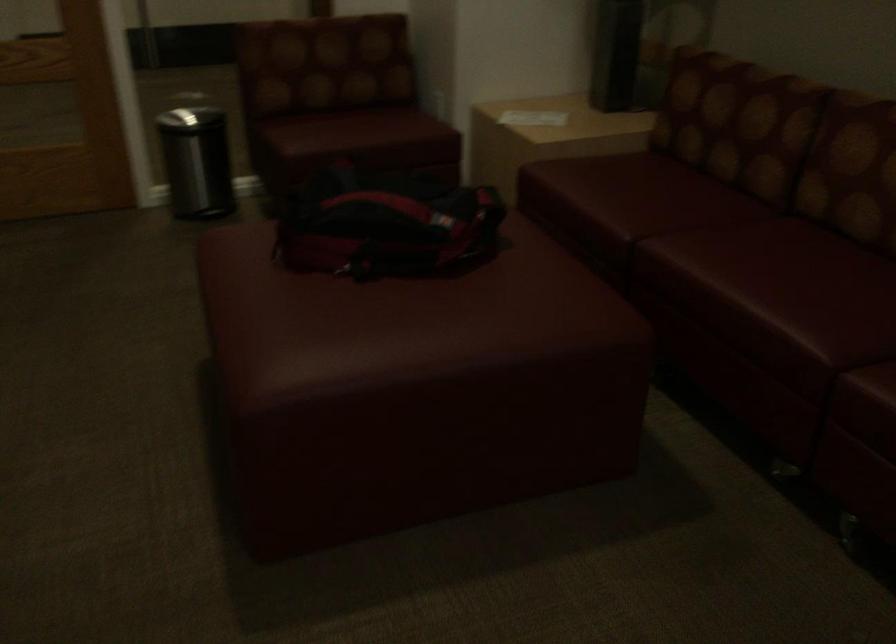
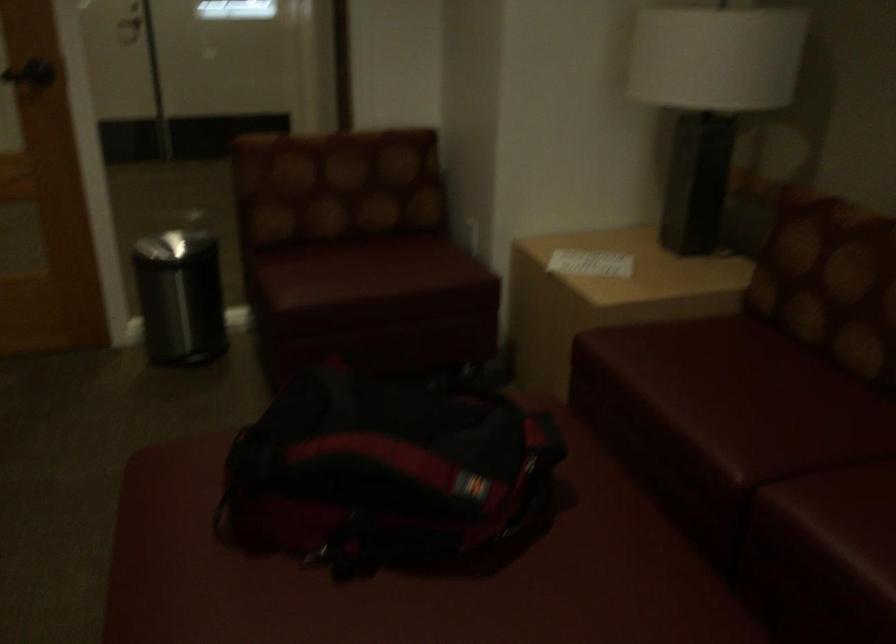
Find the pixel in the second image that matches point 688,252 in the first image.

(834, 522)